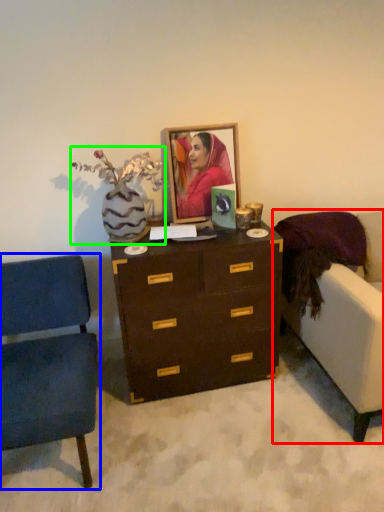
Question: Based on their relative distances, which object is farther from studio couch (highlighted by a red box)? Choose from chair (highlighted by a blue box) and floral arrangement (highlighted by a green box).

Choices:
 (A) chair
 (B) floral arrangement

Answer: (A)